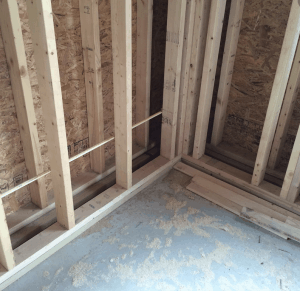
Find the location of a particular element. This screenshot has height=291, width=300. walls is located at coordinates (63, 12), (272, 15), (10, 125).